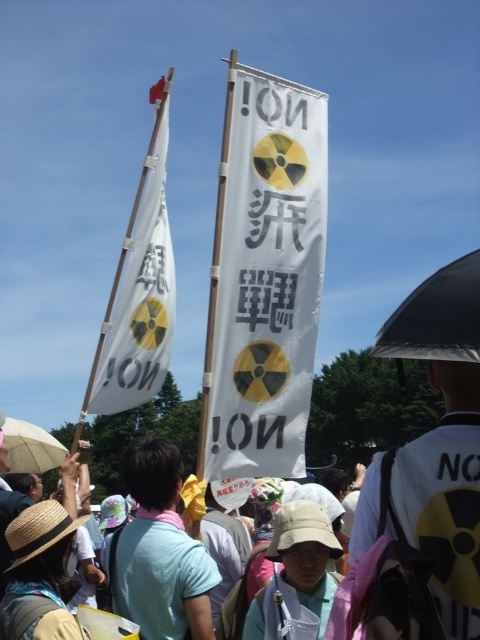
You are a photographer at the protest scene. You need to capture a clear photo of both the light blue cotton shirt at center and the beige fabric umbrella at lower left. Which object should you zoom in on first to ensure it fits in the frame before adjusting for the other?

The light blue cotton shirt at center is larger in size than the beige fabric umbrella at lower left. Therefore, you should first zoom in on the light blue cotton shirt at center to ensure it fits in the frame, then adjust for the smaller beige fabric umbrella at lower left.

You are a photographer trying to capture the protest scene. You notice the white paper banner at center and the beige fabric umbrella at lower left. Which object should you focus on to ensure it appears larger in your photo?

The white paper banner at center should be focused on because it has a larger size compared to the beige fabric umbrella at lower left, making it more prominent in the photo.

You are a photographer at a protest under a clear blue sky. You want to take a photo of the white paper banner at center. Where should you position your camera to capture the banner in the center of your photo?

Position your camera at the coordinates corresponding to the white paper banner at center, which is located at point 0.434 on the x axis and 0.550 on the y axis, to ensure it is centered in your photo.